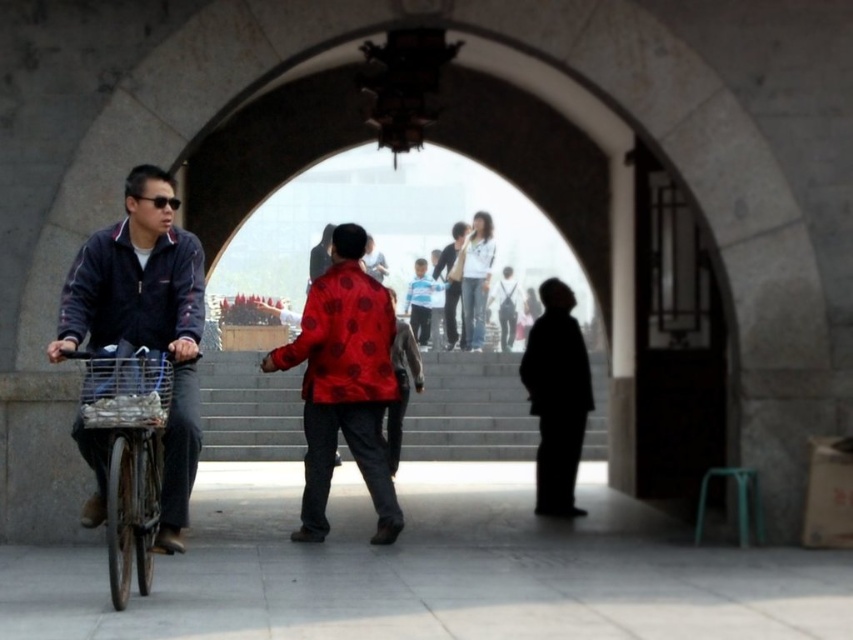
Measure the distance from matte red blouse at center to matte black jacket at center.

matte red blouse at center is 36.06 centimeters from matte black jacket at center.

Between matte red blouse at center and matte black jacket at center, which one has more height?

matte red blouse at center is taller.

Which is in front, point (482, 323) or point (448, 296)?

Point (448, 296) is more forward.

The image size is (853, 640). Identify the location of matte red blouse at center. (474, 280).

Is metallic silver bicycle at left bigger than matte red blouse at center?

No.

Can you confirm if metallic silver bicycle at left is wider than matte red blouse at center?

In fact, metallic silver bicycle at left might be narrower than matte red blouse at center.

Does point (169, 384) come in front of point (463, 282)?

Yes.

Find the location of `metallic silver bicycle at left`. metallic silver bicycle at left is located at coordinates (129, 452).

Who is more distant from viewer, (x=357, y=333) or (x=566, y=388)?

Positioned behind is point (x=566, y=388).

Where is `red dotted fabric at center`? red dotted fabric at center is located at coordinates (344, 384).